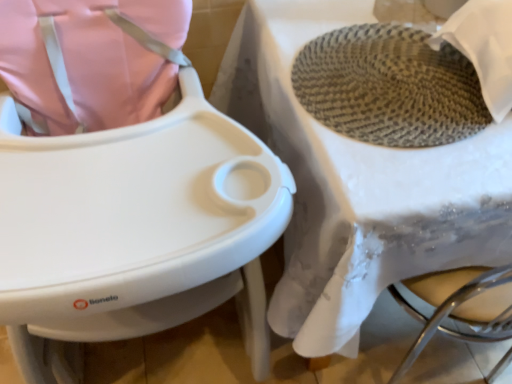
Question: From the image's perspective, is white textured table at center above or below rattan textured basket at upper right?

Choices:
 (A) below
 (B) above

Answer: (B)

Question: Looking at their shapes, would you say white textured table at center is wider or thinner than rattan textured basket at upper right?

Choices:
 (A) thin
 (B) wide

Answer: (B)

Question: Is white textured table at center spatially inside rattan textured basket at upper right, or outside of it?

Choices:
 (A) inside
 (B) outside

Answer: (B)

Question: From a real-world perspective, is rattan textured basket at upper right above or below white textured table at center?

Choices:
 (A) above
 (B) below

Answer: (A)

Question: Does point (221, 187) appear closer or farther from the camera than point (220, 92)?

Choices:
 (A) farther
 (B) closer

Answer: (B)

Question: Is rattan textured basket at upper right wider or thinner than white textured table at center?

Choices:
 (A) wide
 (B) thin

Answer: (B)

Question: Is rattan textured basket at upper right to the left or to the right of white textured table at center in the image?

Choices:
 (A) right
 (B) left

Answer: (B)